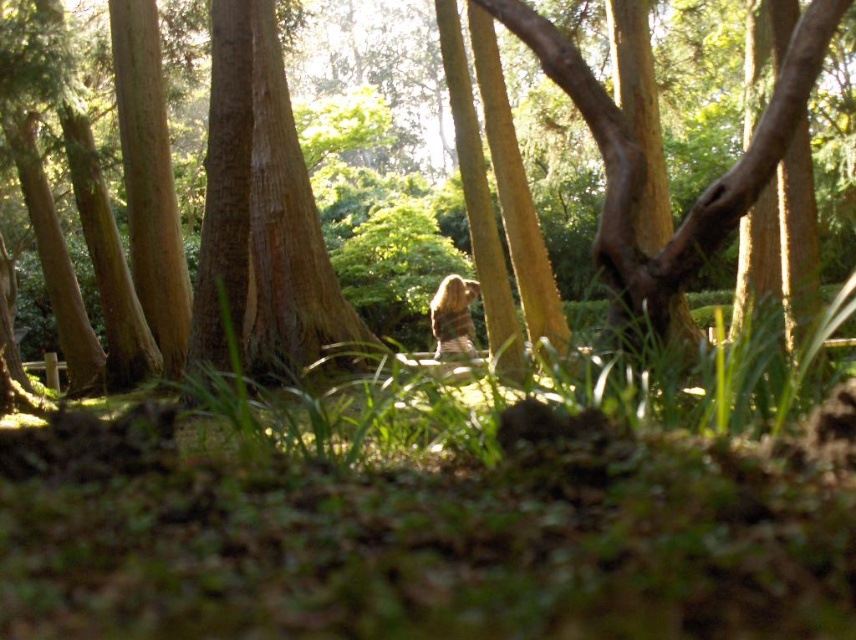
Is green grass at center above brown furry bear at center?

No.

Is green grass at center shorter than brown furry bear at center?

Yes, green grass at center is shorter than brown furry bear at center.

Which is in front, point (792, 604) or point (441, 339)?

Point (792, 604) is in front.

Image resolution: width=856 pixels, height=640 pixels. I want to click on green grass at center, so click(431, 536).

Between brown textured tree trunk at center and smooth brown tree trunk at center, which one is positioned lower?

Positioned lower is smooth brown tree trunk at center.

Between brown textured tree trunk at center and smooth brown tree trunk at center, which one appears on the left side from the viewer's perspective?

brown textured tree trunk at center is more to the left.

Does point (575, 104) lie in front of point (633, 252)?

That is False.

Identify the location of brown textured tree trunk at center. (645, 161).

Which is above, smooth brown tree trunk at center or brown furry bear at center?

smooth brown tree trunk at center is higher up.

Find the location of a particular element. This screenshot has height=640, width=856. smooth brown tree trunk at center is located at coordinates (645, 164).

Where is `smooth brown tree trunk at center`? Image resolution: width=856 pixels, height=640 pixels. smooth brown tree trunk at center is located at coordinates (645, 164).